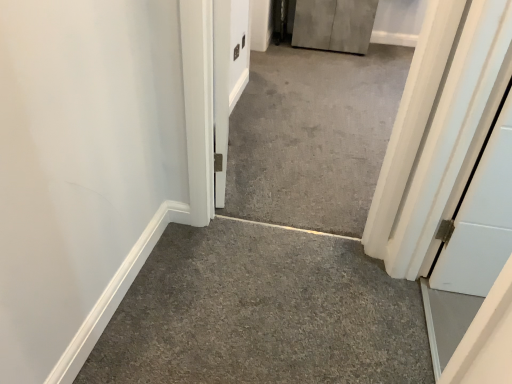
Question: Should I look upward or downward to see gray concrete at center?

Choices:
 (A) down
 (B) up

Answer: (B)